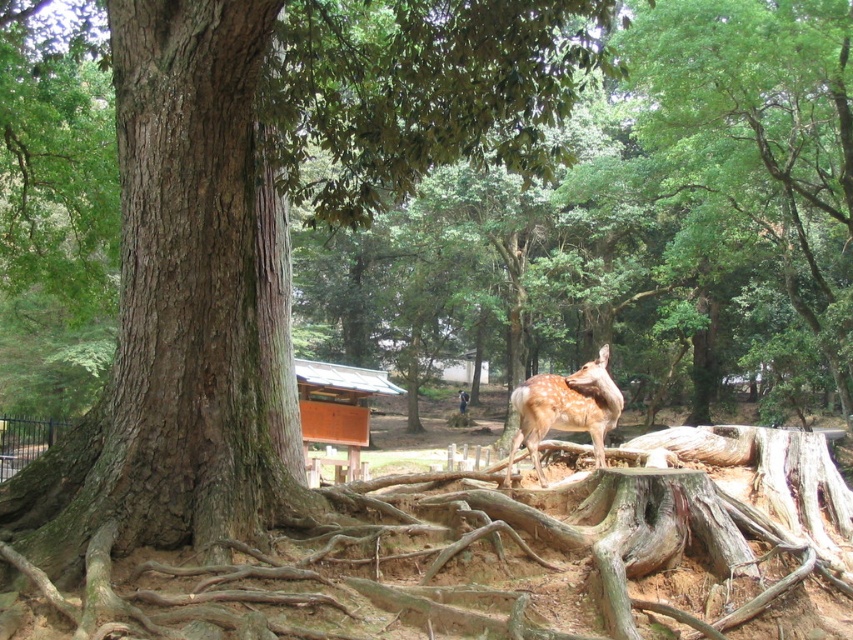
You are a photographer trying to capture both the brown rough tree roots at center and the fawn fur deer at center in the same frame. Based on their positions, which object should you adjust your camera angle to focus on first to ensure both are in the shot?

The brown rough tree roots at center is positioned on the left side of fawn fur deer at center, so you should focus on the fawn fur deer at center first to ensure both are in the frame.

You are a photographer trying to capture both the smooth brown bark at center and the fawn fur deer at center in a single frame. Based on their sizes, which object should you focus on first to ensure both fit in the shot?

The smooth brown bark at center is wider than the fawn fur deer at center, so focusing on the smooth brown bark at center first will ensure both fit in the shot.